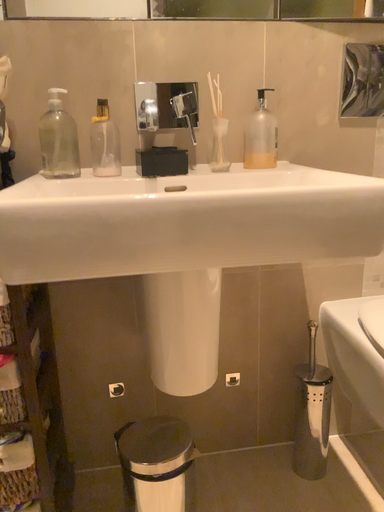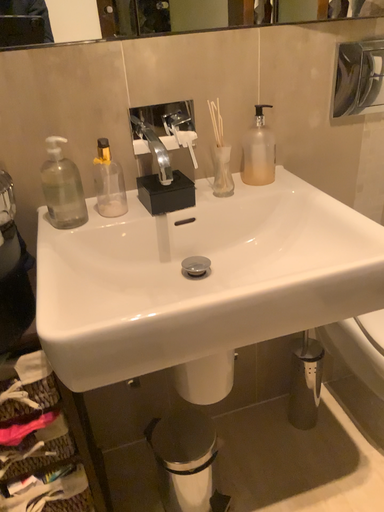
Question: How did the camera likely rotate when shooting the video?

Choices:
 (A) rotated upward
 (B) rotated downward

Answer: (B)